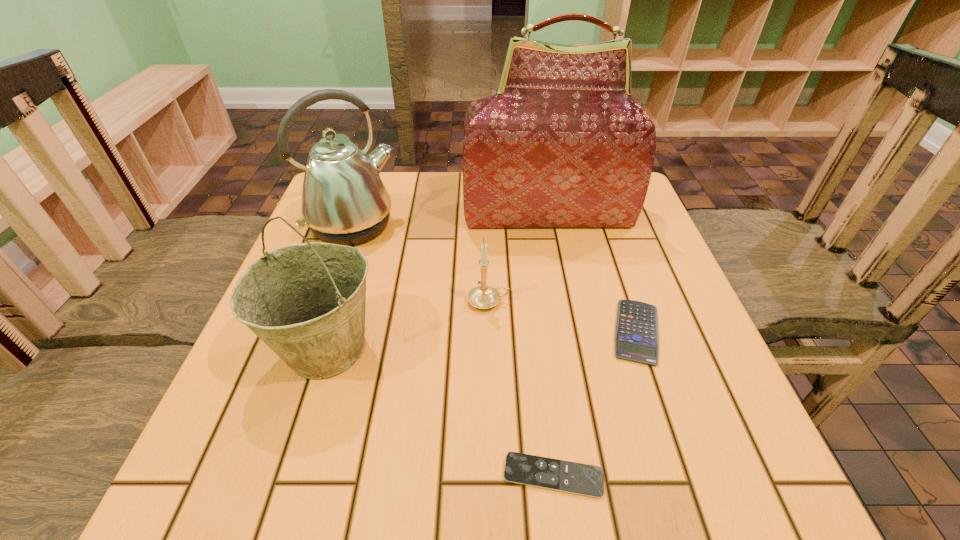
Locate an element on the screen. free space between the wine bucket and the nearest object is located at coordinates (440, 412).

At what (x,y) coordinates should I click in order to perform the action: click on vacant space that's between the calculator and the tallest object. Please return your answer as a coordinate pair (x, y). Looking at the image, I should click on (592, 273).

Find the location of `unoccupied position between the tallest object and the wine bucket`. unoccupied position between the tallest object and the wine bucket is located at coordinates (437, 281).

Identify the location of vacant space that is in between the fourth tallest object and the wine bucket. The width and height of the screenshot is (960, 540). (407, 325).

At what (x,y) coordinates should I click in order to perform the action: click on vacant space that is in between the calculator and the kettle. Please return your answer as a coordinate pair (x, y). Looking at the image, I should click on (495, 279).

The image size is (960, 540). Identify the location of object that ranks as the closest to the remote control. (636, 336).

Identify which object is the closest to the nearest object. Please provide its 2D coordinates. Your answer should be formatted as a tuple, i.e. [(x, y)], where the tuple contains the x and y coordinates of a point satisfying the conditions above.

[(636, 336)]

The image size is (960, 540). What are the coordinates of `vacant space that satisfies the following two spatial constraints: 1. on the handle side of the fourth tallest object; 2. on the left side of the calculator` in the screenshot? It's located at (489, 332).

Where is `vacant point that satisfies the following two spatial constraints: 1. on the front-facing side of the handbag; 2. on the handle side of the candle holder`? vacant point that satisfies the following two spatial constraints: 1. on the front-facing side of the handbag; 2. on the handle side of the candle holder is located at coordinates (564, 301).

Find the location of `vacant area in the image that satisfies the following two spatial constraints: 1. on the front-facing side of the calculator; 2. on the right side of the tallest object`. vacant area in the image that satisfies the following two spatial constraints: 1. on the front-facing side of the calculator; 2. on the right side of the tallest object is located at coordinates (570, 332).